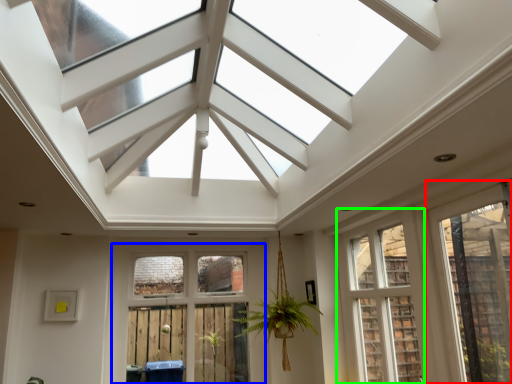
Question: Considering the real-world distances, which object is closest to window (highlighted by a red box)? window (highlighted by a blue box) or window (highlighted by a green box).

Choices:
 (A) window
 (B) window

Answer: (B)